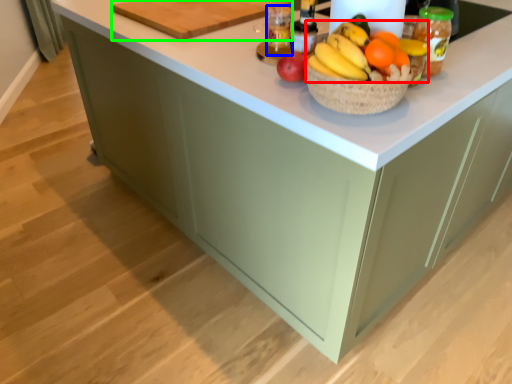
Question: Estimate the real-world distances between objects in this image. Which object is closer to grapefruit (highlighted by a red box), bottle (highlighted by a blue box) or cutting board (highlighted by a green box)?

Choices:
 (A) bottle
 (B) cutting board

Answer: (A)